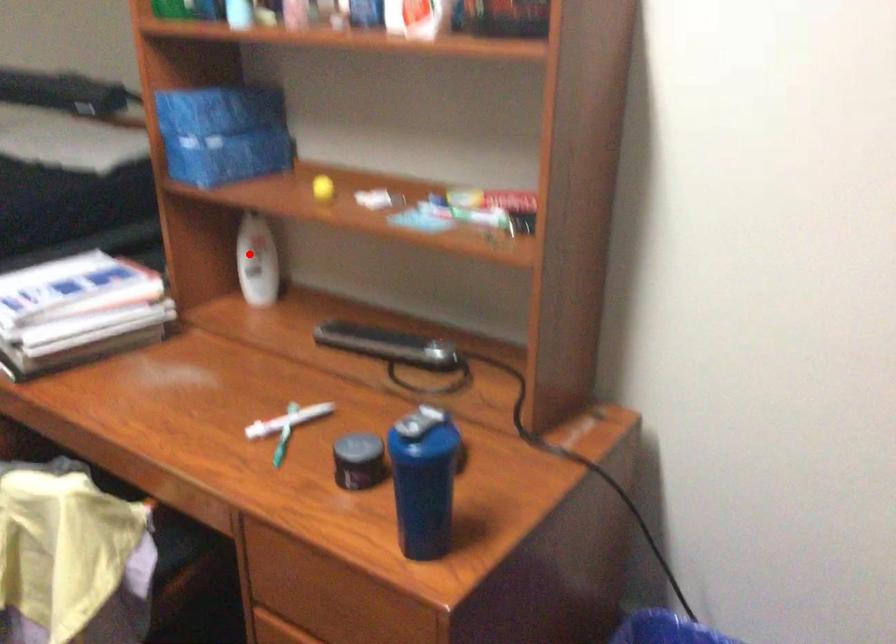
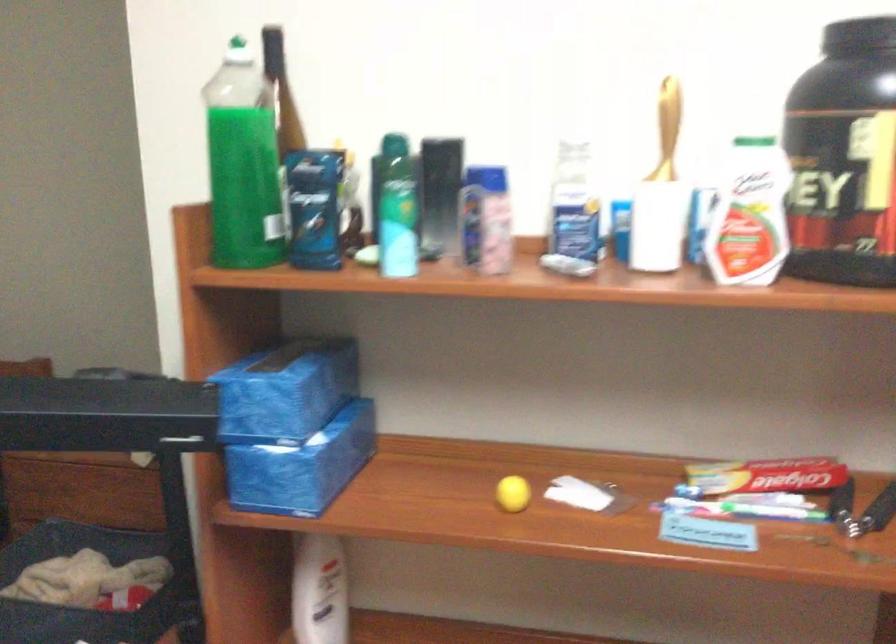
Question: A red point is marked in image1. In image2, is the corresponding 3D point closer to the camera or farther? Reply with the corresponding letter.

Choices:
 (A) The corresponding 3D point is closer.
 (B) The corresponding 3D point is farther.

Answer: (A)